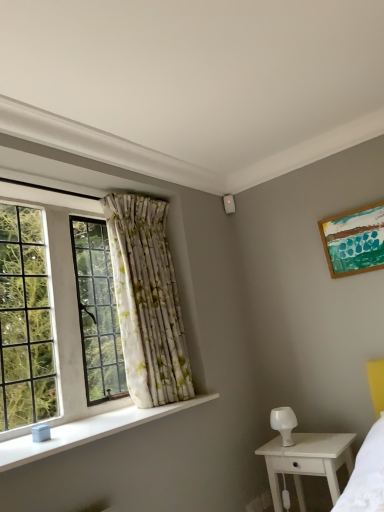
Question: Is clear glass window at left to the left or to the right of wooden picture frame at upper right in the image?

Choices:
 (A) right
 (B) left

Answer: (B)

Question: Is clear glass window at left bigger or smaller than wooden picture frame at upper right?

Choices:
 (A) small
 (B) big

Answer: (B)

Question: Which is farther from the white glossy lamp at lower right?

Choices:
 (A) white wood nightstand at lower right
 (B) wooden picture frame at upper right
 (C) white smooth window sill at lower left
 (D) white floral fabric curtain at left
 (E) clear glass window at left

Answer: (E)

Question: Estimate the real-world distances between objects in this image. Which object is farther from the wooden picture frame at upper right?

Choices:
 (A) white glossy lamp at lower right
 (B) white floral fabric curtain at left
 (C) clear glass window at left
 (D) white smooth window sill at lower left
 (E) white wood nightstand at lower right

Answer: (C)